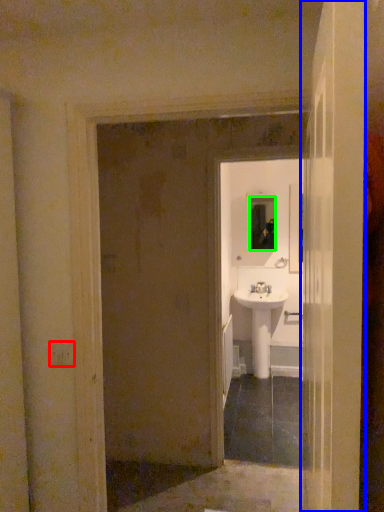
Question: Which object is the closest to the light switch (highlighted by a red box)? Choose among these: door (highlighted by a blue box) or mirror (highlighted by a green box).

Choices:
 (A) door
 (B) mirror

Answer: (A)